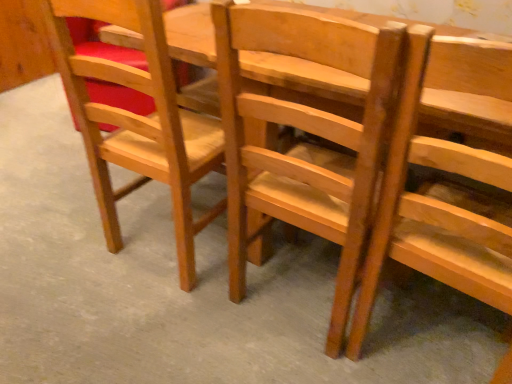
In order to click on vacant space underneath matte wood chair at left, the first chair in the left-to-right sequence (from a real-world perspective) in this screenshot , I will do `click(170, 243)`.